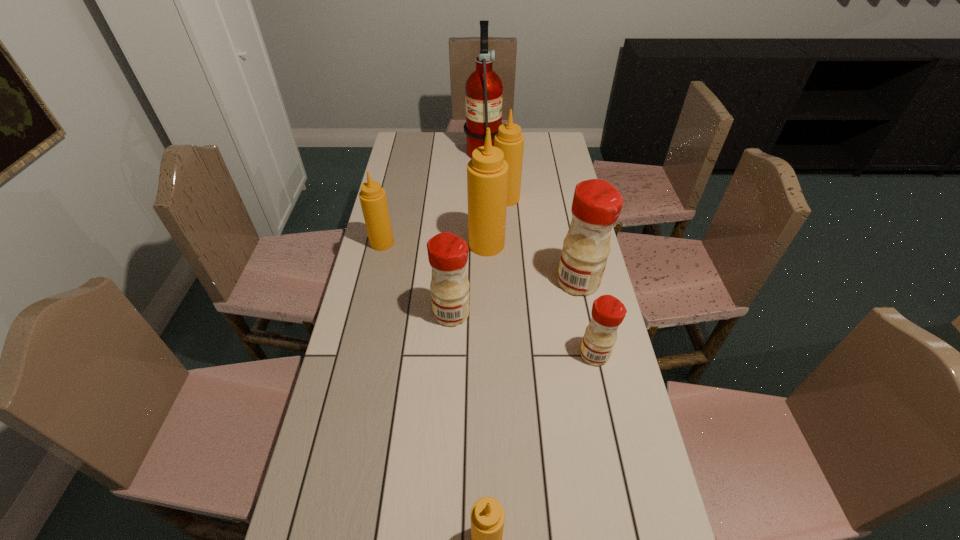
Identify the location of vacant point located on the front of the second biggest red condiment. The height and width of the screenshot is (540, 960). (449, 364).

Locate an element on the screen. The height and width of the screenshot is (540, 960). vacant space situated 0.230m on the front of the nearest red condiment is located at coordinates (614, 448).

Image resolution: width=960 pixels, height=540 pixels. I want to click on object located at the far edge, so click(483, 90).

What are the coordinates of `object situated at the left edge` in the screenshot? It's located at coord(372,196).

In the image, there is a desktop. Identify the location of vacant space at the left edge. (355, 503).

This screenshot has width=960, height=540. In the image, there is a desktop. Find the location of `free space at the right edge`. free space at the right edge is located at coordinates (545, 222).

This screenshot has width=960, height=540. In the image, there is a desktop. Identify the location of vacant space at the far right corner. (558, 135).

At what (x,y) coordinates should I click in order to perform the action: click on free point between the biggest red condiment and the third nearest condiment. Please return your answer as a coordinate pair (x, y). Looking at the image, I should click on (516, 298).

Find the location of `the second closest object to the second nearest object`. the second closest object to the second nearest object is located at coordinates [x=448, y=253].

Select which object is the third closest to the fourth nearest condiment. Please provide its 2D coordinates. Your answer should be formatted as a tuple, i.e. [(x, y)], where the tuple contains the x and y coordinates of a point satisfying the conditions above.

[(448, 253)]